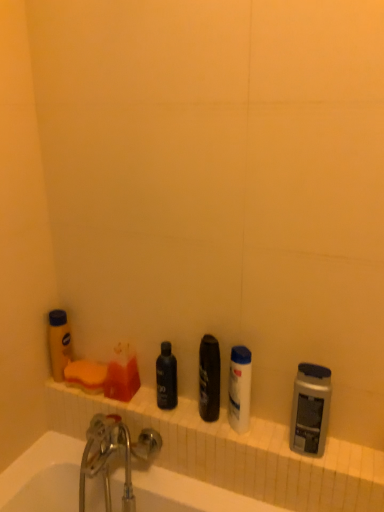
Question: From the image's perspective, is metallic gray shaver at right, the first toiletry in the right-to-left sequence, positioned above or below yellow matte bottle at left, the 5th toiletry when ordered from right to left?

Choices:
 (A) below
 (B) above

Answer: (A)

Question: Is metallic gray shaver at right, marked as the fifth toiletry in a left-to-right arrangement, bigger or smaller than yellow matte bottle at left, the 5th toiletry when ordered from right to left?

Choices:
 (A) big
 (B) small

Answer: (A)

Question: Estimate the real-world distances between objects in this image. Which object is farther from the white ceramic ledge at lower center?

Choices:
 (A) yellow matte bottle at left, the 5th toiletry when ordered from right to left
 (B) white ceramic bathtub at lower left
 (C) white plastic mouthwash at center
 (D) translucent plastic soap at upper left, the 2th toiletry in the left-to-right sequence
 (E) black matte bottle at center, which is the third toiletry in left-to-right order

Answer: (A)

Question: Which object is positioned farthest from the white ceramic ledge at lower center?

Choices:
 (A) shiny black can at center, placed as the fourth toiletry when sorted from left to right
 (B) black matte bottle at center, which is the third toiletry in left-to-right order
 (C) metallic gray shaver at right, the first toiletry in the right-to-left sequence
 (D) yellow matte bottle at left, the 5th toiletry when ordered from right to left
 (E) white plastic mouthwash at center

Answer: (D)